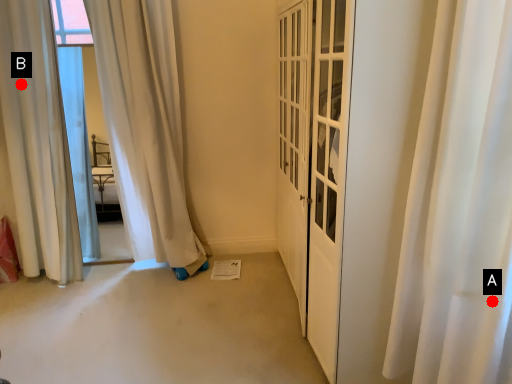
Question: Two points are circled on the image, labeled by A and B beside each circle. Which point is closer to the camera?

Choices:
 (A) A is closer
 (B) B is closer

Answer: (A)